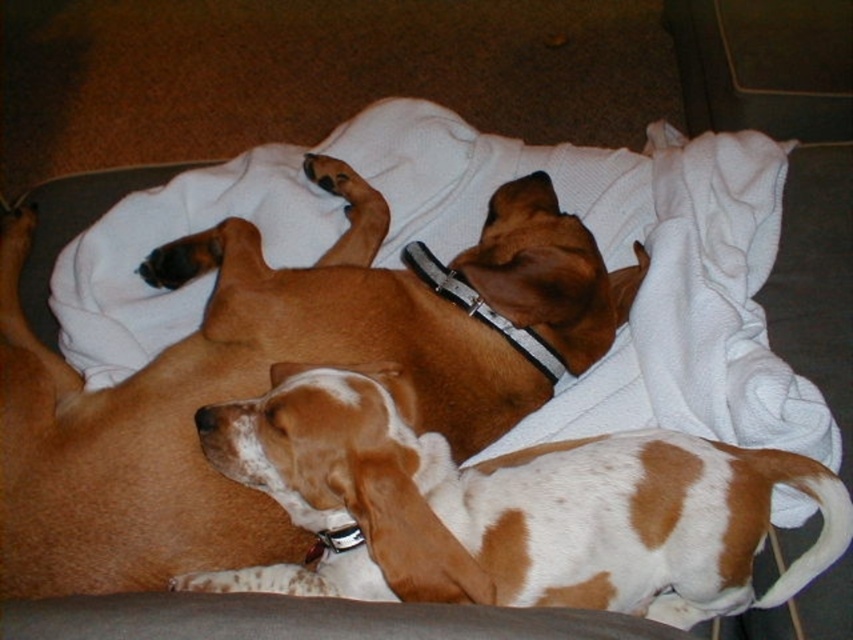
Is brown smooth dog at upper center to the right of white and brown fur at center from the viewer's perspective?

In fact, brown smooth dog at upper center is to the left of white and brown fur at center.

This screenshot has height=640, width=853. I want to click on brown smooth dog at upper center, so click(268, 378).